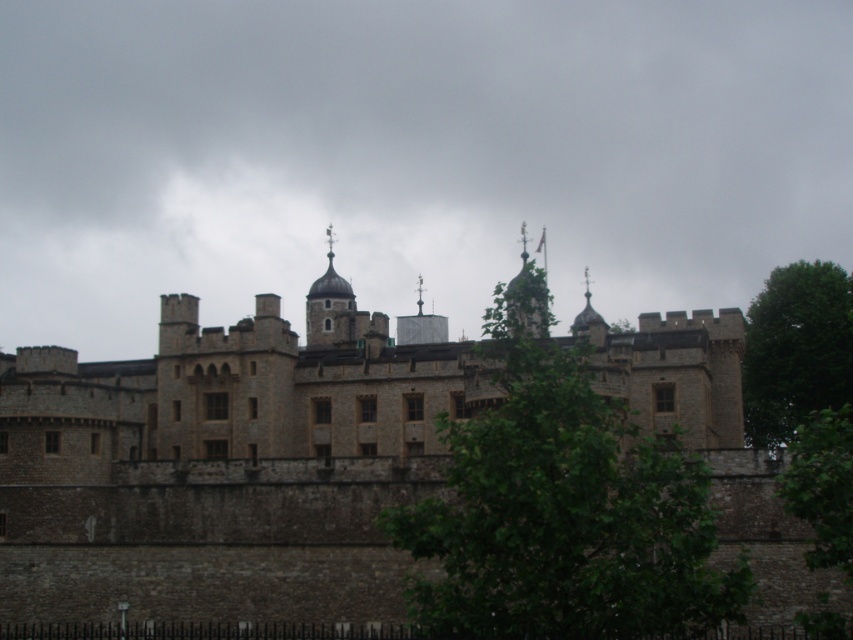
Question: Estimate the real-world distances between objects in this image. Which object is farther from the green leafy tree at center?

Choices:
 (A) stone castle at center
 (B) green leafy tree at right

Answer: (B)

Question: Does green leafy tree at center have a larger size compared to green leafy tree at right?

Choices:
 (A) no
 (B) yes

Answer: (B)

Question: Observing the image, what is the correct spatial positioning of stone castle at center in reference to green leafy tree at right?

Choices:
 (A) above
 (B) below

Answer: (B)

Question: Is green leafy tree at center to the right of green leafy tree at right from the viewer's perspective?

Choices:
 (A) no
 (B) yes

Answer: (A)

Question: Which of the following is the farthest from the observer?

Choices:
 (A) coord(134,580)
 (B) coord(461,563)

Answer: (A)

Question: Which is farther from the stone castle at center?

Choices:
 (A) green leafy tree at center
 (B) green leafy tree at right

Answer: (B)